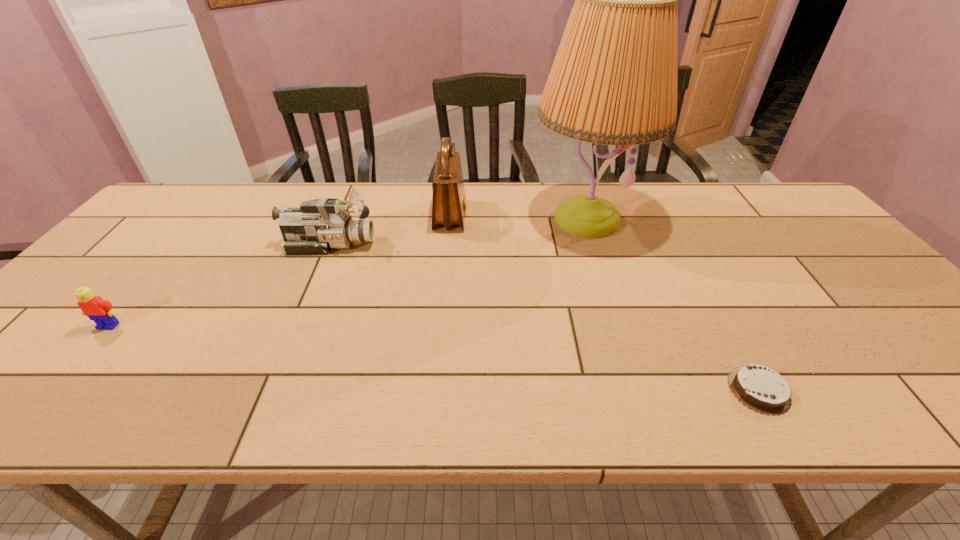
Find the location of `free region located on the front flap of the second tallest object`. free region located on the front flap of the second tallest object is located at coordinates (566, 215).

The image size is (960, 540). Find the location of `free point located on the front-facing side of the camcorder`. free point located on the front-facing side of the camcorder is located at coordinates (491, 244).

At what (x,y) coordinates should I click in order to perform the action: click on free region located 0.110m on the front-facing side of the Lego. Please return your answer as a coordinate pair (x, y). Looking at the image, I should click on [x=71, y=369].

The height and width of the screenshot is (540, 960). Identify the location of free space located 0.070m on the back of the nearest object. (732, 341).

The width and height of the screenshot is (960, 540). I want to click on lamp that is at the far edge, so [x=614, y=79].

Where is `shoulder bag situated at the far edge`? The height and width of the screenshot is (540, 960). shoulder bag situated at the far edge is located at coordinates (448, 205).

The width and height of the screenshot is (960, 540). Find the location of `object that is at the near edge`. object that is at the near edge is located at coordinates point(757,387).

Image resolution: width=960 pixels, height=540 pixels. Find the location of `object that is at the left edge`. object that is at the left edge is located at coordinates (101, 311).

In the image, there is a desktop. Identify the location of free space at the far edge. (265, 204).

Find the location of `free region at the near edge of the desktop`. free region at the near edge of the desktop is located at coordinates (684, 396).